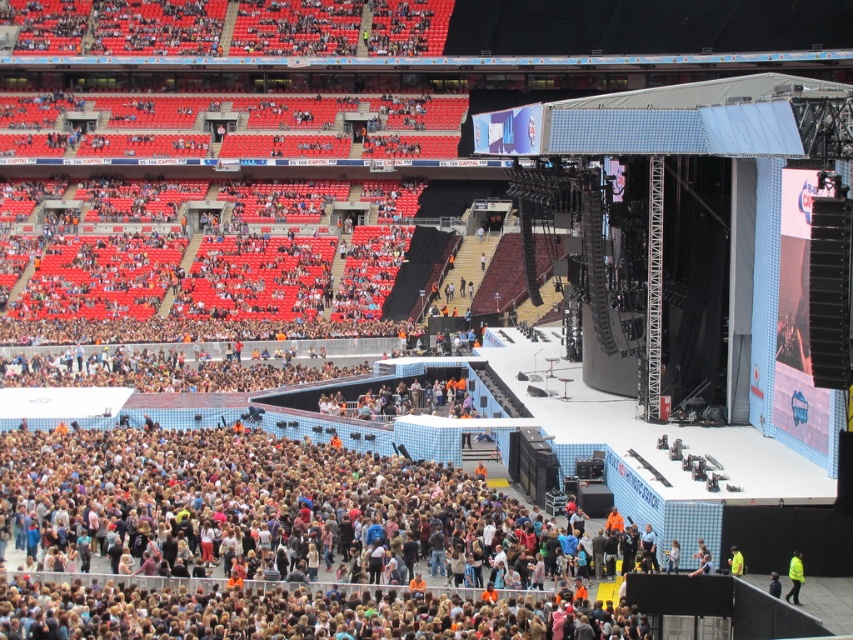
Based on the photo, you are a security guard at Wembley Stadium and need to locate your missing reflective vest. You remember leaving it somewhere near the stage area. Based on the image provided, where exactly can you find the yellow reflective vest at lower right?

The yellow reflective vest at lower right is located at coordinates point (x=793, y=577).

You are a security guard at the concert venue. You notice two yellow items at the lower right of your view. Which one is taller between the yellow reflective vest at lower right and the yellow fabric at lower right?

The yellow reflective vest at lower right is taller than the yellow fabric at lower right.